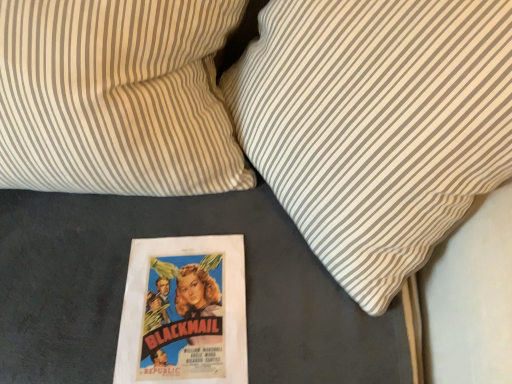
Question: Considering the relative positions of white striped pillow at upper right, marked as the 1th pillow in a left-to-right arrangement, and white striped pillow at center, the 2th pillow from the left, in the image provided, is white striped pillow at upper right, marked as the 1th pillow in a left-to-right arrangement, to the left or to the right of white striped pillow at center, the 2th pillow from the left,?

Choices:
 (A) left
 (B) right

Answer: (A)

Question: Does point (177, 115) appear closer or farther from the camera than point (367, 132)?

Choices:
 (A) farther
 (B) closer

Answer: (A)

Question: In terms of height, does white striped pillow at upper right, which is the second pillow from right to left, look taller or shorter compared to white striped pillow at center, which ranks as the first pillow in right-to-left order?

Choices:
 (A) tall
 (B) short

Answer: (B)

Question: In terms of width, does white striped pillow at center, the 2th pillow from the left, look wider or thinner when compared to white striped pillow at upper right, which is the second pillow from right to left?

Choices:
 (A) thin
 (B) wide

Answer: (B)

Question: Based on their positions, is white striped pillow at center, the 2th pillow from the left, located to the left or right of white striped pillow at upper right, marked as the 1th pillow in a left-to-right arrangement?

Choices:
 (A) left
 (B) right

Answer: (B)

Question: Considering the positions of white striped pillow at center, which ranks as the first pillow in right-to-left order, and white striped pillow at upper right, which is the second pillow from right to left, in the image, is white striped pillow at center, which ranks as the first pillow in right-to-left order, bigger or smaller than white striped pillow at upper right, which is the second pillow from right to left,?

Choices:
 (A) small
 (B) big

Answer: (B)

Question: From the image's perspective, is white striped pillow at center, which ranks as the first pillow in right-to-left order, positioned above or below white striped pillow at upper right, which is the second pillow from right to left?

Choices:
 (A) below
 (B) above

Answer: (A)